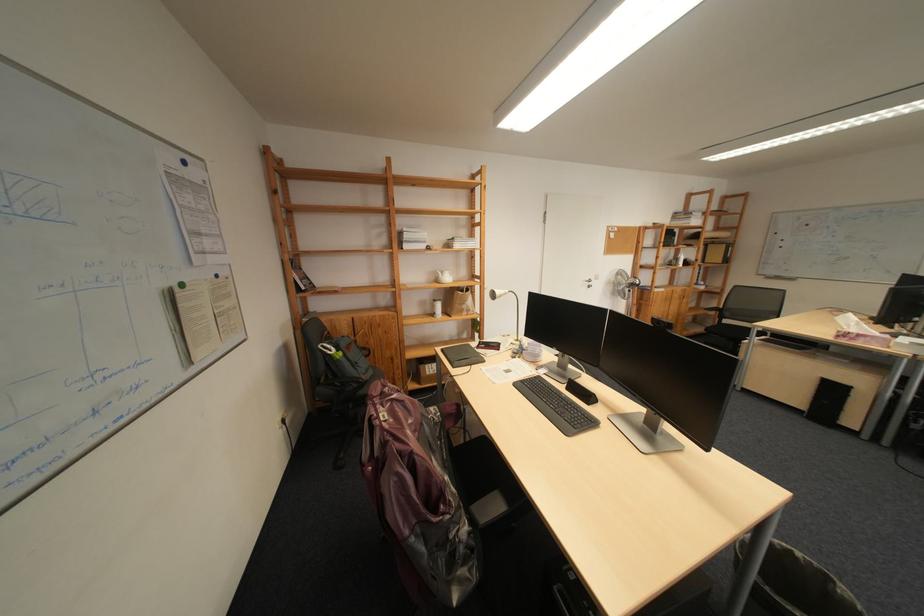
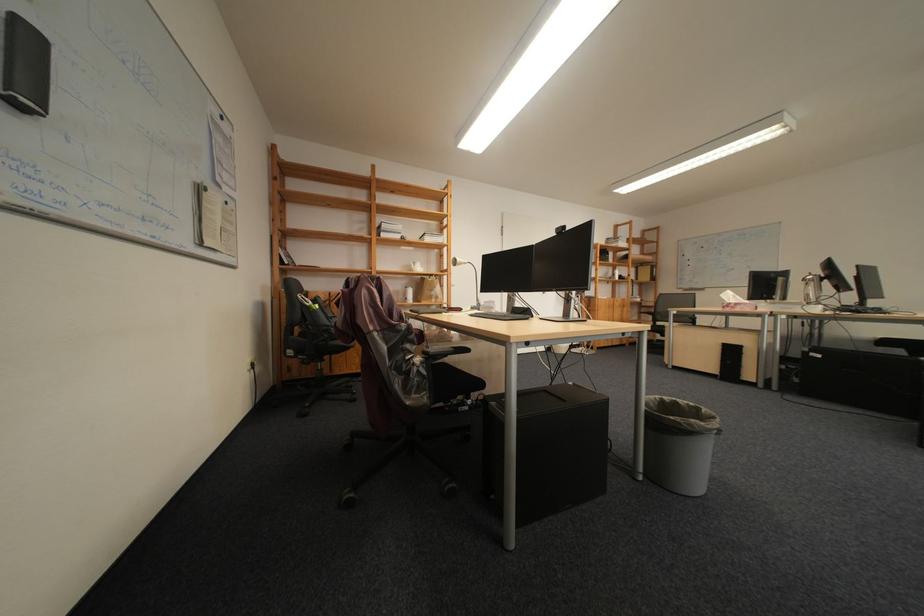
Find the pixel in the second image that matches point 868,339 in the first image.

(747, 309)